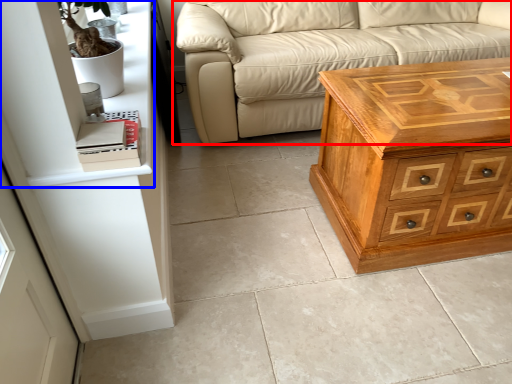
Question: Which of the following is the closest to the observer, studio couch (highlighted by a red box) or shelf (highlighted by a blue box)?

Choices:
 (A) studio couch
 (B) shelf

Answer: (B)